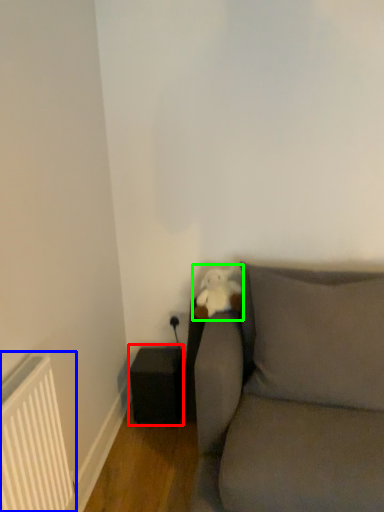
Question: Which object is positioned farthest from speaker (highlighted by a red box)? Select from radiator (highlighted by a blue box) and toy (highlighted by a green box).

Choices:
 (A) radiator
 (B) toy

Answer: (A)